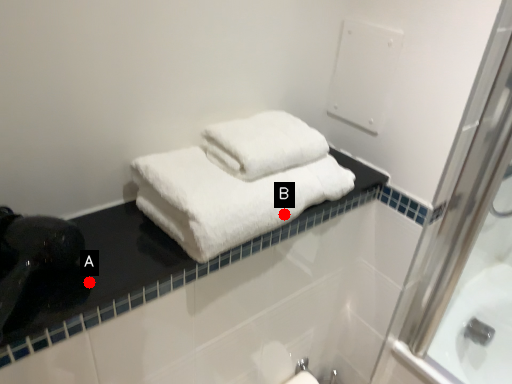
Question: Two points are circled on the image, labeled by A and B beside each circle. Which of the following is the closest to the observer?

Choices:
 (A) A is closer
 (B) B is closer

Answer: (A)